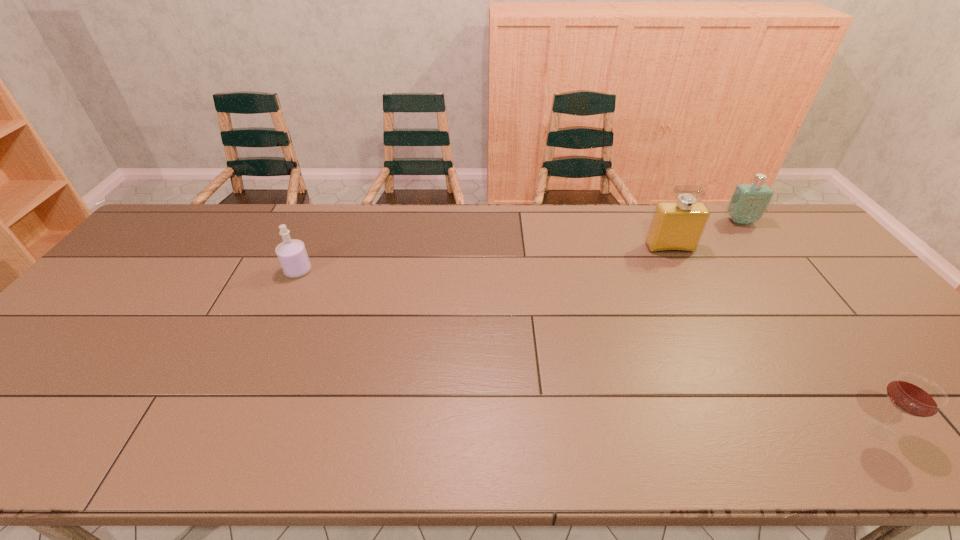
At what (x,y) coordinates should I click in order to perform the action: click on free space between the wineglass and the tallest object. Please return your answer as a coordinate pair (x, y). The height and width of the screenshot is (540, 960). Looking at the image, I should click on (774, 339).

The width and height of the screenshot is (960, 540). I want to click on free space between the nearest object and the farthest object, so click(809, 325).

This screenshot has height=540, width=960. I want to click on vacant point located between the rightmost perfume and the nearest object, so click(x=809, y=325).

Locate an element on the screen. The height and width of the screenshot is (540, 960). vacant area that lies between the nearest perfume and the third object from right to left is located at coordinates (484, 259).

Where is `empty location between the wineglass and the rightmost perfume`? The height and width of the screenshot is (540, 960). empty location between the wineglass and the rightmost perfume is located at coordinates (809, 325).

Locate an element on the screen. Image resolution: width=960 pixels, height=540 pixels. vacant area between the rightmost perfume and the tallest object is located at coordinates (705, 235).

Identify the location of free spot between the farthest object and the wineglass. Image resolution: width=960 pixels, height=540 pixels. click(x=809, y=325).

Locate an element on the screen. vacant point located between the wineglass and the second nearest object is located at coordinates (588, 350).

At what (x,y) coordinates should I click in order to perform the action: click on object that stands as the second closest to the wineglass. Please return your answer as a coordinate pair (x, y). This screenshot has height=540, width=960. Looking at the image, I should click on (749, 201).

I want to click on the closest object relative to the wineglass, so click(677, 226).